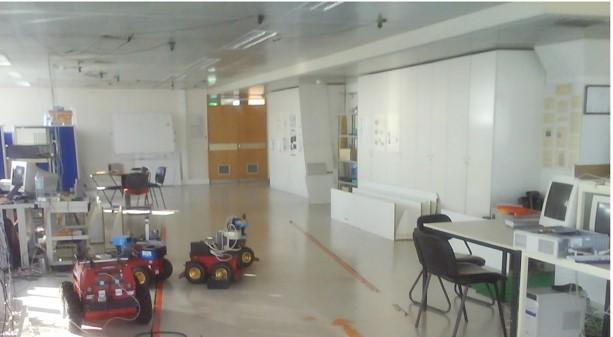
Identify the location of ceiling. (151, 23).